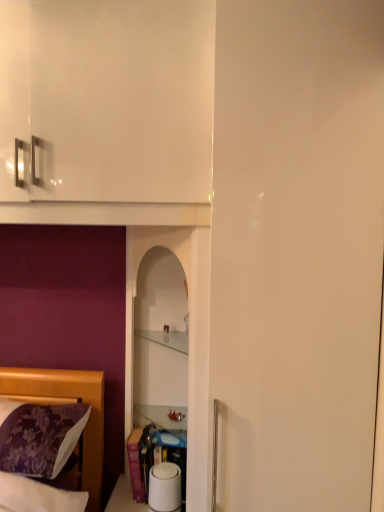
Identify the location of clear glass cabinet at center. (167, 339).

Describe the element at coordinates (189, 336) in the screenshot. I see `transparent glass shelf at center` at that location.

The height and width of the screenshot is (512, 384). What are the coordinates of `clear glass cabinet at center` in the screenshot? It's located at (167, 339).

From a real-world perspective, is transparent glass shelf at center positioned under clear glass cabinet at center based on gravity?

Correct, in the physical world, transparent glass shelf at center is lower than clear glass cabinet at center.

Considering the positions of point (193, 376) and point (179, 348), is point (193, 376) closer or farther from the camera than point (179, 348)?

Point (193, 376) is closer to the camera than point (179, 348).

Could you tell me if transparent glass shelf at center is turned towards clear glass cabinet at center?

Yes, transparent glass shelf at center is oriented towards clear glass cabinet at center.

Considering the relative positions of transparent glass shelf at center and clear glass cabinet at center in the image provided, is transparent glass shelf at center to the left of clear glass cabinet at center from the viewer's perspective?

Yes.

Considering the positions of objects purple floral fabric at lower left and clear glass cabinet at center in the image provided, who is more to the left, purple floral fabric at lower left or clear glass cabinet at center?

From the viewer's perspective, purple floral fabric at lower left appears more on the left side.

The width and height of the screenshot is (384, 512). Find the location of `bed below the clear glass cabinet at center (from a real-world perspective)`. bed below the clear glass cabinet at center (from a real-world perspective) is located at coordinates (68, 401).

Are purple floral fabric at lower left and clear glass cabinet at center located far from each other?

That's not correct — purple floral fabric at lower left is a little close to clear glass cabinet at center.

Between clear glass cabinet at center and transparent glass shelf at center, which one is positioned behind?

Positioned behind is clear glass cabinet at center.

Is clear glass cabinet at center looking in the opposite direction of transparent glass shelf at center?

Yes, clear glass cabinet at center's orientation is away from transparent glass shelf at center.

Is clear glass cabinet at center next to transparent glass shelf at center and touching it?

There is a gap between clear glass cabinet at center and transparent glass shelf at center.

Who is taller, clear glass cabinet at center or transparent glass shelf at center?

With more height is transparent glass shelf at center.

Is clear glass cabinet at center positioned with its back to purple floral fabric at lower left?

No.

Is purple floral fabric at lower left surrounded by clear glass cabinet at center?

No.

Considering the relative positions of clear glass cabinet at center and purple floral fabric at lower left in the image provided, is clear glass cabinet at center behind purple floral fabric at lower left?

Yes, clear glass cabinet at center is behind purple floral fabric at lower left.

Between clear glass cabinet at center and purple floral fabric at lower left, which one has larger width?

purple floral fabric at lower left is wider.

Does point (28, 393) appear closer or farther from the camera than point (207, 473)?

Point (28, 393).

Considering the sizes of objects purple floral fabric at lower left and transparent glass shelf at center in the image provided, who is taller, purple floral fabric at lower left or transparent glass shelf at center?

transparent glass shelf at center is taller.

Is there a large distance between purple floral fabric at lower left and transparent glass shelf at center?

They are positioned close to each other.

Is purple floral fabric at lower left inside or outside of transparent glass shelf at center?

purple floral fabric at lower left is spatially situated outside transparent glass shelf at center.

In terms of size, does transparent glass shelf at center appear bigger or smaller than purple floral fabric at lower left?

Clearly, transparent glass shelf at center is larger in size than purple floral fabric at lower left.

Based on their positions, is transparent glass shelf at center located to the left or right of purple floral fabric at lower left?

Based on their positions, transparent glass shelf at center is located to the right of purple floral fabric at lower left.

Is transparent glass shelf at center wider than purple floral fabric at lower left?

In fact, transparent glass shelf at center might be narrower than purple floral fabric at lower left.

This screenshot has width=384, height=512. What are the coordinates of `glass door in front of the clear glass cabinet at center` in the screenshot? It's located at 189,336.

You are a GUI agent. You are given a task and a screenshot of the screen. Output one action in this format:
    pyautogui.click(x=<x>, y=<y>)
    Task: Click on the bed that appears below the clear glass cabinet at center (from a real-world perspective)
    The image size is (384, 512).
    Given the screenshot: What is the action you would take?
    pyautogui.click(x=68, y=401)

From the picture: Looking at the image, which one is located further to clear glass cabinet at center, purple floral fabric at lower left or transparent glass shelf at center?

→ Among the two, purple floral fabric at lower left is located further to clear glass cabinet at center.

When comparing their distances from clear glass cabinet at center, does transparent glass shelf at center or purple floral fabric at lower left seem closer?

transparent glass shelf at center is closer to clear glass cabinet at center.

Estimate the real-world distances between objects in this image. Which object is further from purple floral fabric at lower left, clear glass cabinet at center or transparent glass shelf at center?

Among the two, clear glass cabinet at center is located further to purple floral fabric at lower left.

From the image, which object appears to be farther from purple floral fabric at lower left, transparent glass shelf at center or clear glass cabinet at center?

clear glass cabinet at center is further to purple floral fabric at lower left.

Looking at this image, which object lies further to the anchor point transparent glass shelf at center, purple floral fabric at lower left or clear glass cabinet at center?

The object further to transparent glass shelf at center is purple floral fabric at lower left.

Looking at the image, which one is located closer to transparent glass shelf at center, clear glass cabinet at center or purple floral fabric at lower left?

clear glass cabinet at center is closer to transparent glass shelf at center.

Where is `glass door between purple floral fabric at lower left and clear glass cabinet at center in the horizontal direction`? This screenshot has width=384, height=512. glass door between purple floral fabric at lower left and clear glass cabinet at center in the horizontal direction is located at coordinates (189, 336).